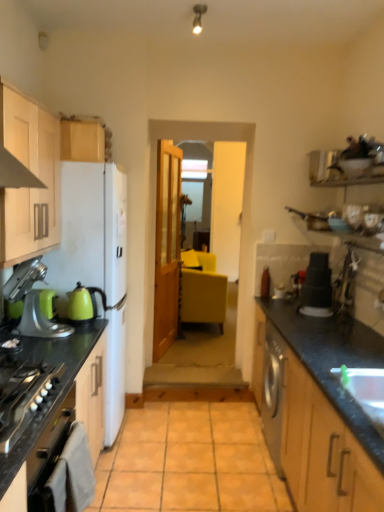
The width and height of the screenshot is (384, 512). Describe the element at coordinates (189, 461) in the screenshot. I see `orange tile at center` at that location.

Locate an element on the screen. This screenshot has height=512, width=384. stainless steel oven at left is located at coordinates (25, 400).

Measure the distance between point [81,320] and camera.

A distance of 2.48 meters exists between point [81,320] and camera.

Find the location of a particular element. green glossy kettle at left, the 2th kitchen appliance viewed from the front is located at coordinates (84, 304).

What do you see at coordinates (317, 287) in the screenshot? I see `matte black stack at right` at bounding box center [317, 287].

Measure the distance between wooden cabinet at upper left, the first cabinetry from the back, and camera.

They are 8.18 feet apart.

Image resolution: width=384 pixels, height=512 pixels. In order to click on orange tile at center in this screenshot , I will do `click(189, 461)`.

Based on the photo, considering the positions of objects satin nickel faucet at right and green glossy kettle at left, the 2th kitchen appliance viewed from the front, in the image provided, who is more to the right, satin nickel faucet at right or green glossy kettle at left, the 2th kitchen appliance viewed from the front,?

Positioned to the right is satin nickel faucet at right.

Can you confirm if satin nickel faucet at right is taller than green glossy kettle at left, the 2th kitchen appliance viewed from the front?

Indeed, satin nickel faucet at right has a greater height compared to green glossy kettle at left, the 2th kitchen appliance viewed from the front.

Is satin nickel faucet at right oriented towards green glossy kettle at left, the 2th kitchen appliance viewed from the front?

No, satin nickel faucet at right is not oriented towards green glossy kettle at left, the 2th kitchen appliance viewed from the front.

How many degrees apart are the facing directions of satin nickel faucet at right and green glossy kettle at left, which ranks as the 1th kitchen appliance in back-to-front order?

There is a 180-degree angle between the facing directions of satin nickel faucet at right and green glossy kettle at left, which ranks as the 1th kitchen appliance in back-to-front order.

Consider the image. Considering the sizes of objects orange tile at center and matte black stack at right in the image provided, who is thinner, orange tile at center or matte black stack at right?

Thinner between the two is matte black stack at right.

Measure the distance from orange tile at center to matte black stack at right.

orange tile at center and matte black stack at right are 3.98 feet apart from each other.

From a real-world perspective, who is located lower, orange tile at center or matte black stack at right?

In real-world perspective, orange tile at center is lower.

Is black matte oven at lower left closer to the viewer compared to orange tile at center?

That is True.

Based on their sizes in the image, would you say black matte oven at lower left is bigger or smaller than orange tile at center?

Clearly, black matte oven at lower left is smaller in size than orange tile at center.

Does black matte oven at lower left have a greater width compared to orange tile at center?

In fact, black matte oven at lower left might be narrower than orange tile at center.

How many degrees apart are the facing directions of black matte oven at lower left and orange tile at center?

The angle between the facing direction of black matte oven at lower left and the facing direction of orange tile at center is 90.4 degrees.

Find the location of a particular element. The image size is (384, 512). the 2nd kitchen appliance in front of the satin nickel faucet at right is located at coordinates (32, 301).

Which of these two, satin nickel faucet at right or metallic silver stand mixer at left, which is the second kitchen appliance in back-to-front order, is smaller?

With smaller size is satin nickel faucet at right.

Considering the sizes of objects satin nickel faucet at right and metallic silver stand mixer at left, the first kitchen appliance viewed from the front, in the image provided, who is taller, satin nickel faucet at right or metallic silver stand mixer at left, the first kitchen appliance viewed from the front,?

Standing taller between the two is satin nickel faucet at right.

Is satin nickel faucet at right positioned with its back to metallic silver stand mixer at left, which is the second kitchen appliance in back-to-front order?

That's not correct — satin nickel faucet at right is not looking away from metallic silver stand mixer at left, which is the second kitchen appliance in back-to-front order.

From a real-world perspective, is green glossy kettle at left, the 2th kitchen appliance viewed from the front, positioned over black matte oven at lower left based on gravity?

Yes, from a real-world perspective, green glossy kettle at left, the 2th kitchen appliance viewed from the front, is above black matte oven at lower left.

Can you confirm if green glossy kettle at left, the 2th kitchen appliance viewed from the front, is thinner than black matte oven at lower left?

No, green glossy kettle at left, the 2th kitchen appliance viewed from the front, is not thinner than black matte oven at lower left.

Between green glossy kettle at left, which ranks as the 1th kitchen appliance in back-to-front order, and black matte oven at lower left, which one is positioned behind?

green glossy kettle at left, which ranks as the 1th kitchen appliance in back-to-front order, is further from the camera.

Consider the image. From a real-world perspective, is wooden cabinet at upper left, which appears as the second cabinetry when viewed from the front, located higher than matte yellow chair at center?

Correct, in the physical world, wooden cabinet at upper left, which appears as the second cabinetry when viewed from the front, is higher than matte yellow chair at center.

Is point (91, 138) closer to camera compared to point (219, 276)?

Yes, it is in front of point (219, 276).

Between wooden cabinet at upper left, the first cabinetry from the back, and matte yellow chair at center, which one has larger size?

matte yellow chair at center is bigger.

What's the angular difference between wooden cabinet at upper left, the first cabinetry from the back, and matte yellow chair at center's facing directions?

The facing directions of wooden cabinet at upper left, the first cabinetry from the back, and matte yellow chair at center are 4.22 degrees apart.

Does black granite countertop at left, acting as the second countertop starting from the right, have a larger size compared to wooden cabinet at upper left, the first cabinetry from the back?

Indeed, black granite countertop at left, acting as the second countertop starting from the right, has a larger size compared to wooden cabinet at upper left, the first cabinetry from the back.

How different are the orientations of black granite countertop at left, acting as the second countertop starting from the right, and wooden cabinet at upper left, the first cabinetry from the back, in degrees?

There is a 1.65-degree angle between the facing directions of black granite countertop at left, acting as the second countertop starting from the right, and wooden cabinet at upper left, the first cabinetry from the back.

From a real-world perspective, between black granite countertop at left, acting as the second countertop starting from the right, and wooden cabinet at upper left, which appears as the second cabinetry when viewed from the front, who is vertically higher?

wooden cabinet at upper left, which appears as the second cabinetry when viewed from the front, is physically above.

You are a GUI agent. You are given a task and a screenshot of the screen. Output one action in this format:
    pyautogui.click(x=<x>, y=<y>)
    Task: Click on the faucet that appears above the green glossy kettle at left, the 2th kitchen appliance viewed from the front (from the image's perspective)
    The height and width of the screenshot is (512, 384).
    Given the screenshot: What is the action you would take?
    pyautogui.click(x=345, y=281)

Locate an element on the screen. The image size is (384, 512). tile lying below the matte black stack at right (from the image's perspective) is located at coordinates (189, 461).

From the image, which object appears to be farther from clear glass door at center, orange tile at center or stainless steel oven at left?

stainless steel oven at left lies further to clear glass door at center than the other object.

Looking at the image, which one is located closer to stainless steel oven at left, matte wood cabinets at left, which appears as the 1th cabinetry when viewed from the front, or black matte oven at lower left?

black matte oven at lower left is positioned closer to the anchor stainless steel oven at left.

From the image, which object appears to be farther from orange tile at center, metallic silver stand mixer at left, the first kitchen appliance viewed from the front, or clear glass door at center?

clear glass door at center is further to orange tile at center.

When comparing their distances from black granite countertop at right, the first countertop from the right, does black matte oven at lower left or black granite countertop at left, acting as the first countertop starting from the left, seem closer?

The object closer to black granite countertop at right, the first countertop from the right, is black granite countertop at left, acting as the first countertop starting from the left.

Looking at the image, which one is located closer to matte yellow chair at center, clear glass door at center or matte black stack at right?

matte black stack at right is positioned closer to the anchor matte yellow chair at center.

Estimate the real-world distances between objects in this image. Which object is closer to matte wood cabinets at left, which appears as the 1th cabinetry when viewed from the front, wooden cabinet at upper left, which appears as the second cabinetry when viewed from the front, or matte yellow chair at center?

wooden cabinet at upper left, which appears as the second cabinetry when viewed from the front, is positioned closer to the anchor matte wood cabinets at left, which appears as the 1th cabinetry when viewed from the front.

Estimate the real-world distances between objects in this image. Which object is further from matte black stack at right, satin nickel faucet at right or clear glass door at center?

clear glass door at center is further to matte black stack at right.

Considering their positions, is stainless steel oven at left positioned closer to matte yellow chair at center than orange tile at center?

orange tile at center is positioned closer to the anchor matte yellow chair at center.

This screenshot has height=512, width=384. I want to click on appliance between white glossy sink at lower right and clear glass door at center along the z-axis, so click(317, 287).

The height and width of the screenshot is (512, 384). In order to click on kitchen appliance situated between black granite countertop at left, acting as the second countertop starting from the right, and metallic silver shelf at upper right from left to right in this screenshot , I will do `click(84, 304)`.

Locate an element on the screen. This screenshot has height=512, width=384. glass door located between wooden cabinet at upper left, which appears as the second cabinetry when viewed from the front, and matte yellow chair at center in the depth direction is located at coordinates (232, 217).

Where is `appliance between orange tile at center and matte yellow chair at center in the front-back direction`? appliance between orange tile at center and matte yellow chair at center in the front-back direction is located at coordinates (317, 287).